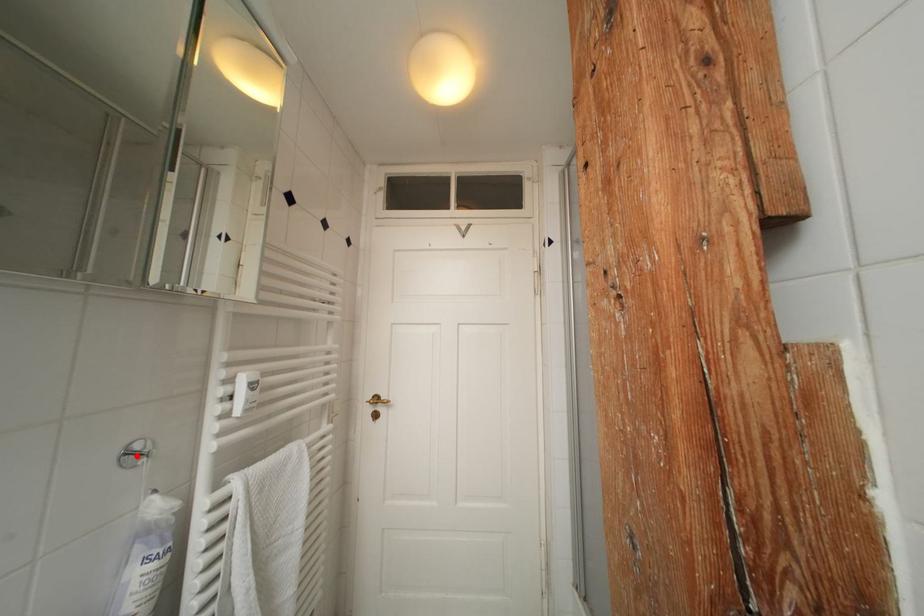
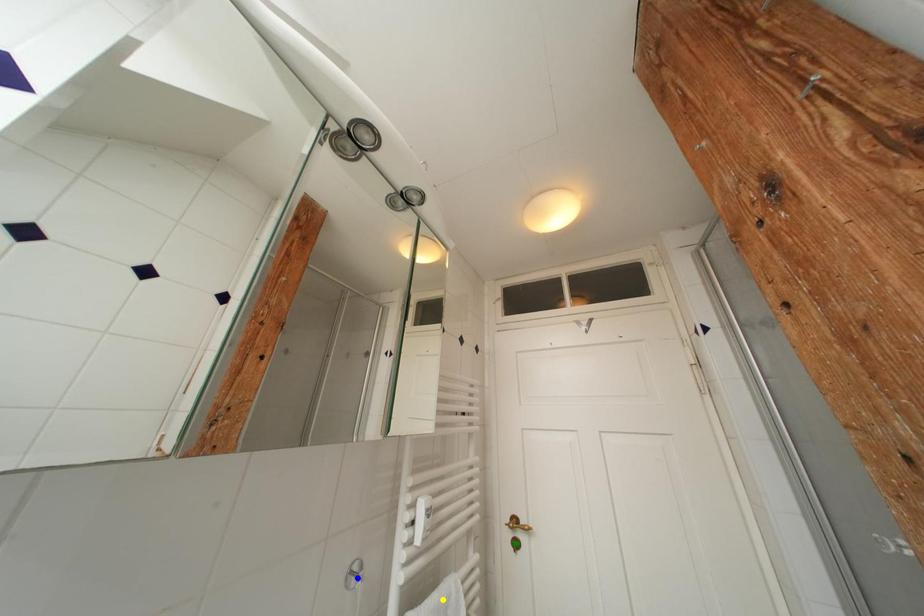
Question: I am providing you with two images of the same scene from different viewpoints. A red point is marked on the first image. You are given multiple points on the second image. Can you choose the point in image 2 that corresponds to the point in image 1?

Choices:
 (A) blue point
 (B) green point
 (C) yellow point

Answer: (A)